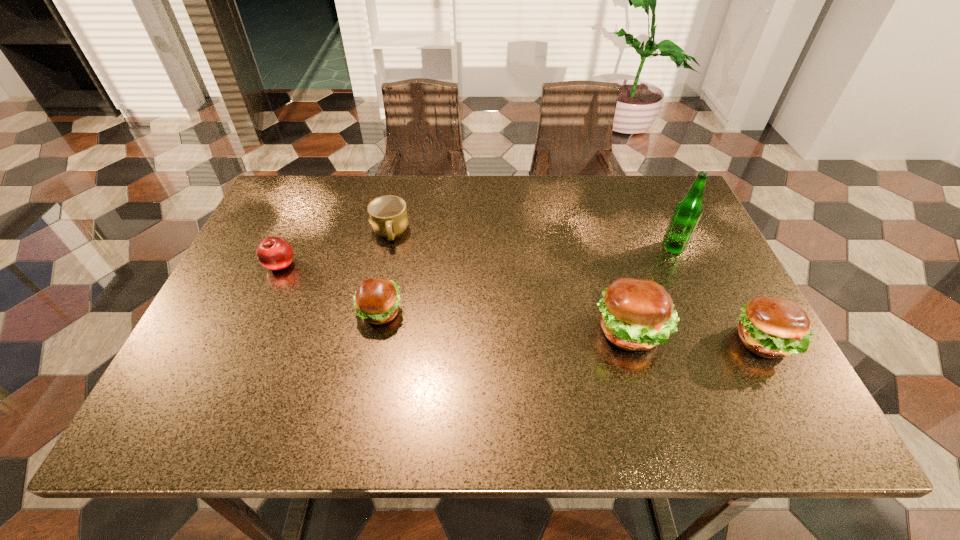
Find the location of a particular element. The width and height of the screenshot is (960, 540). vacant space situated on the left of the third object from right to left is located at coordinates (570, 332).

I want to click on vacant space located 0.330m on the left of the third tallest object, so click(579, 341).

Image resolution: width=960 pixels, height=540 pixels. I want to click on free region located 0.120m on the back of the apple, so click(299, 225).

Identify the location of vacant space located 0.290m on the side with the handle of the mug. Image resolution: width=960 pixels, height=540 pixels. (367, 341).

I want to click on free space located on the label of the fifth object from left to right, so click(x=570, y=248).

Identify the location of free space located on the label of the fifth object from left to right. The image size is (960, 540). (623, 248).

The height and width of the screenshot is (540, 960). I want to click on blank space located on the label of the fifth object from left to right, so click(563, 248).

This screenshot has width=960, height=540. What are the coordinates of `object at the far edge` in the screenshot? It's located at (388, 217).

In order to click on object that is at the left edge in this screenshot , I will do pos(274,253).

Locate an element on the screen. Image resolution: width=960 pixels, height=540 pixels. hamburger positioned at the right edge is located at coordinates (770, 327).